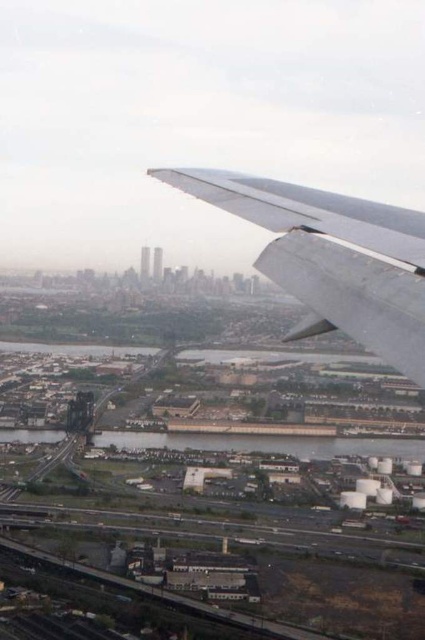
From the picture: Who is higher up, metallic gray wing at upper right or metallic gray waterway at lower center?

metallic gray wing at upper right

Who is more distant from viewer, (175, 170) or (8, 433)?

The point (175, 170) is more distant.

Who is more forward, (175, 176) or (255, 440)?

Point (255, 440) is in front.

This screenshot has width=425, height=640. In order to click on metallic gray wing at upper right in this screenshot , I will do `click(308, 211)`.

Can you confirm if metallic silver wing at upper right is smaller than metallic gray waterway at lower center?

No, metallic silver wing at upper right is not smaller than metallic gray waterway at lower center.

This screenshot has height=640, width=425. Describe the element at coordinates (331, 259) in the screenshot. I see `metallic silver wing at upper right` at that location.

Is point (359, 228) positioned before point (130, 445)?

That is False.

Locate an element on the screen. metallic silver wing at upper right is located at coordinates (331, 259).

Which is above, metallic silver wing at upper right or metallic gray wing at upper right?

metallic gray wing at upper right is above.

Locate an element on the screen. The image size is (425, 640). metallic silver wing at upper right is located at coordinates (331, 259).